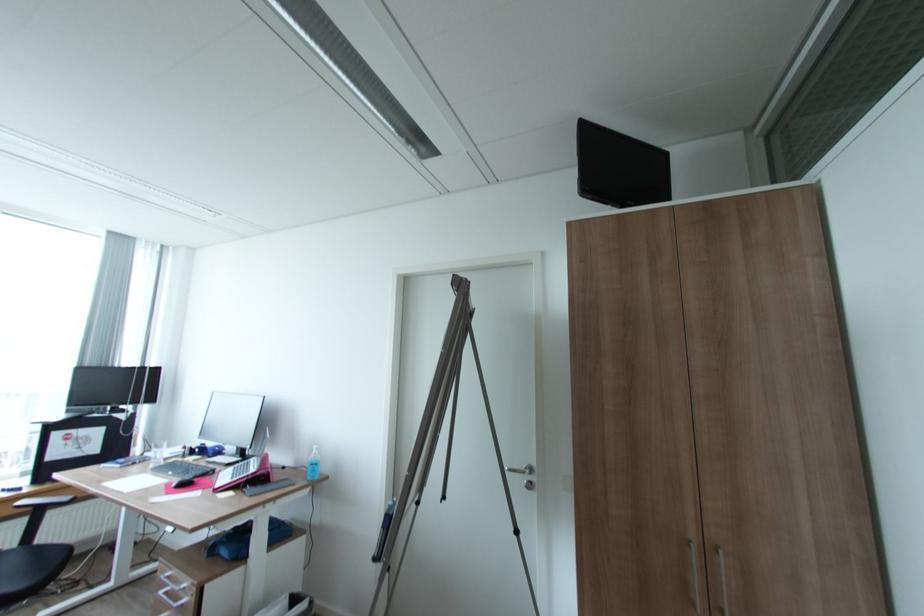
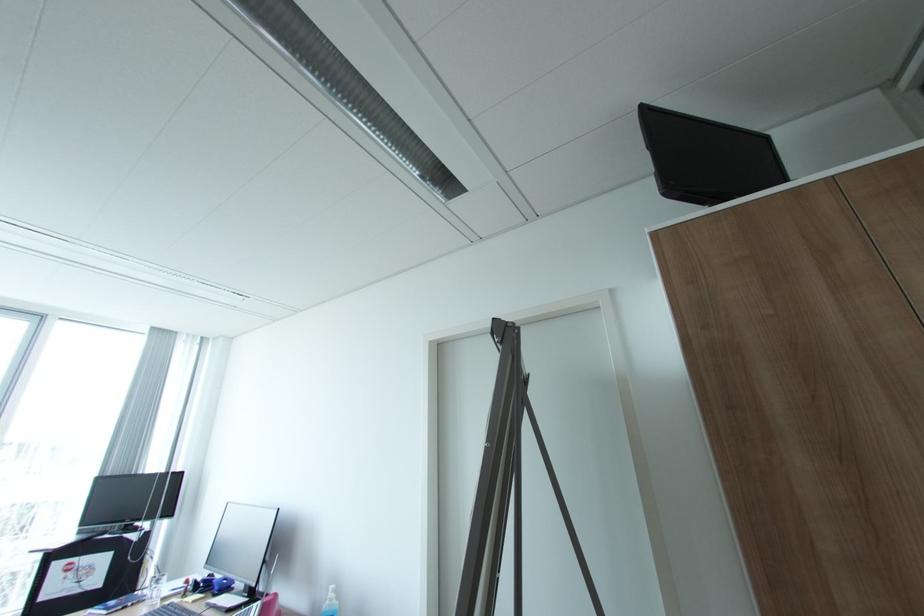
Question: Which direction would the cameraman need to move to produce the second image? Reply with the corresponding letter.

Choices:
 (A) Left
 (B) Right
 (C) Forward
 (D) Backward

Answer: (C)